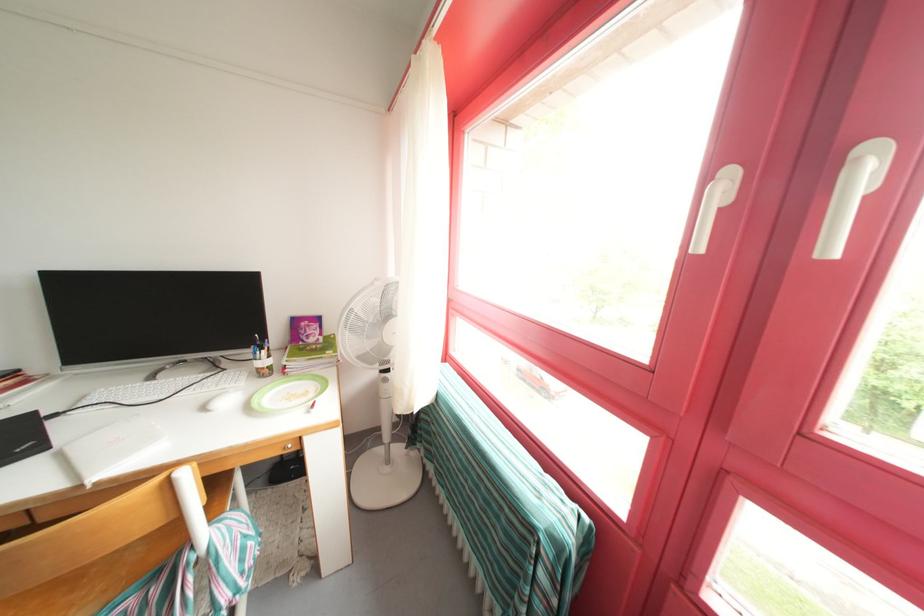
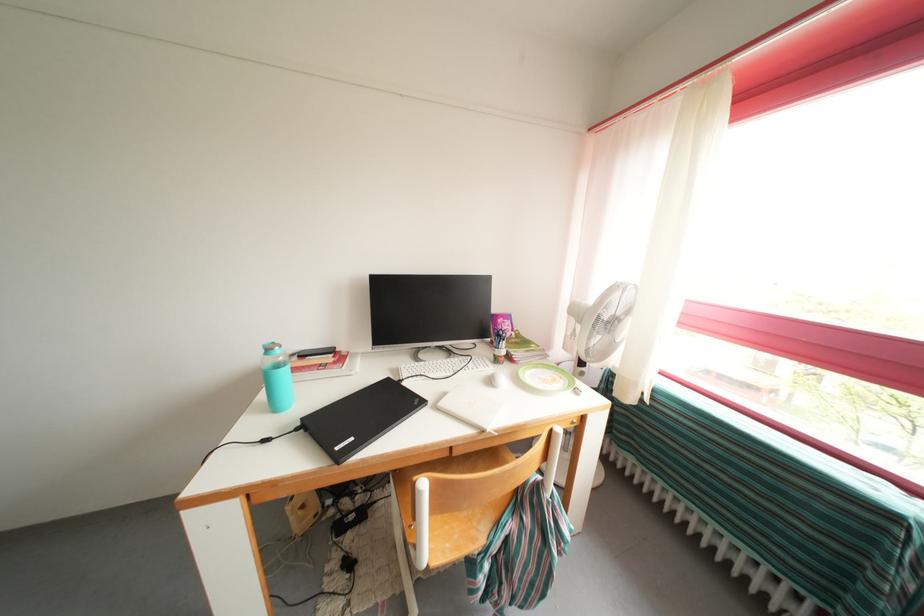
Question: The images are taken continuously from a first-person perspective. In which direction are you moving?

Choices:
 (A) Left
 (B) Right
 (C) Forward
 (D) Backward

Answer: (A)